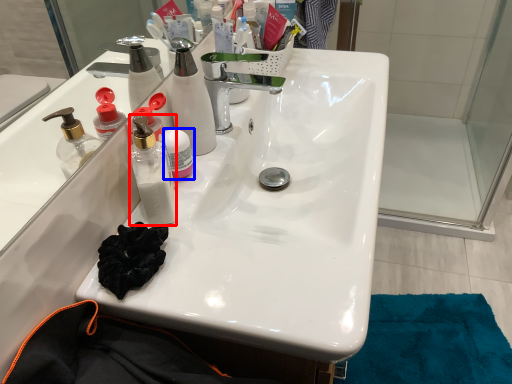
Question: Which of the following is the farthest to the observer, bottle (highlighted by a red box) or bottle (highlighted by a blue box)?

Choices:
 (A) bottle
 (B) bottle

Answer: (B)